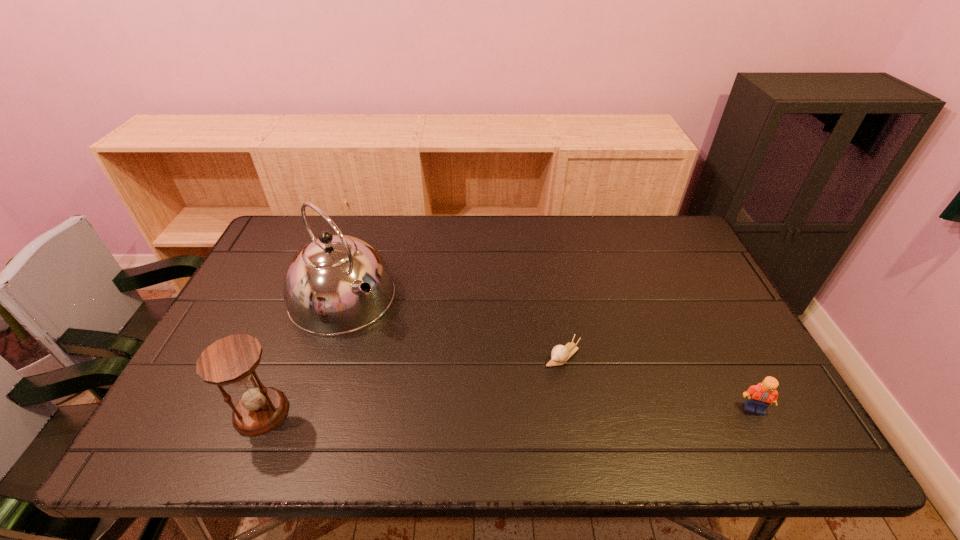
You are a GUI agent. You are given a task and a screenshot of the screen. Output one action in this format:
    pyautogui.click(x=<x>, y=<y>)
    Task: Click on the vacant space on the desktop that is between the hourglass and the Lego and is positioned from the spout of the kettle
    This screenshot has height=540, width=960.
    Given the screenshot: What is the action you would take?
    pyautogui.click(x=463, y=411)

I want to click on vacant spot on the desktop that is between the hourglass and the second shortest object and is positioned on the shell of the second object from right to left, so click(x=507, y=410).